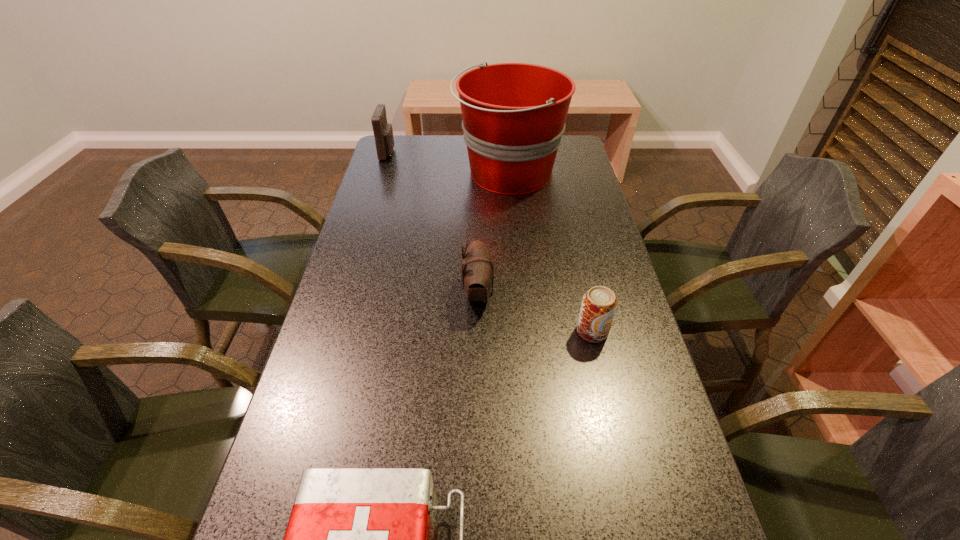
Locate an element on the screen. This screenshot has height=540, width=960. the tallest object is located at coordinates (514, 114).

Image resolution: width=960 pixels, height=540 pixels. In order to click on the leftmost object in this screenshot , I will do `click(383, 132)`.

Locate an element on the screen. The image size is (960, 540). the left pouch is located at coordinates (383, 132).

What are the coordinates of `the shorter pouch` in the screenshot? It's located at (477, 271).

Locate an element on the screen. The height and width of the screenshot is (540, 960). the nearer pouch is located at coordinates (477, 271).

Where is `beer can`? beer can is located at coordinates (599, 304).

This screenshot has height=540, width=960. I want to click on vacant space located 0.090m on the back of the tallest object, so click(505, 137).

Find the location of `free space located 0.060m with an open flap on the left pouch`. free space located 0.060m with an open flap on the left pouch is located at coordinates (411, 153).

The height and width of the screenshot is (540, 960). I want to click on vacant area situated 0.090m with the flap open on the nearer pouch, so click(529, 293).

The image size is (960, 540). I want to click on vacant space located on the front of the beer can, so click(x=629, y=488).